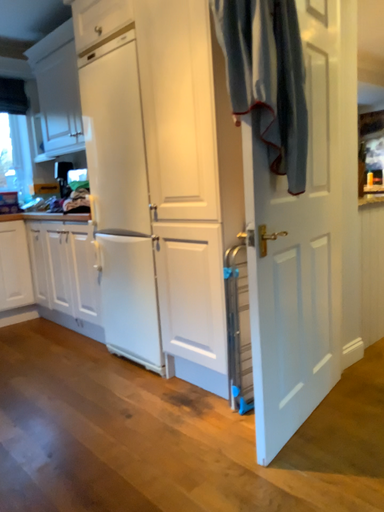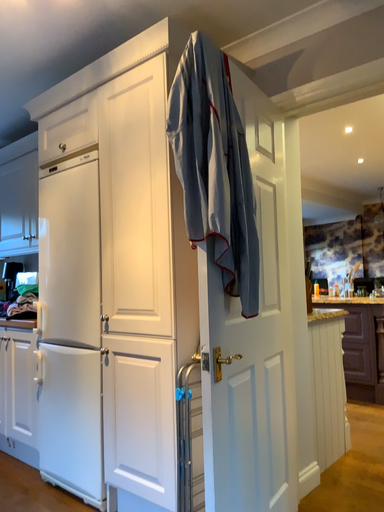
Question: Which way did the camera rotate in the video?

Choices:
 (A) rotated upward
 (B) rotated downward

Answer: (A)